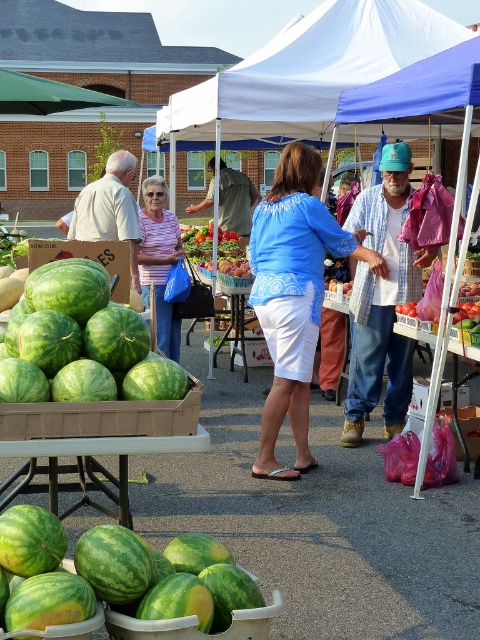
Does point (262, 465) come in front of point (360, 412)?

Yes, point (262, 465) is closer to viewer.

Is blue cotton blouse at center to the right of blue plaid shirt at center from the viewer's perspective?

No, blue cotton blouse at center is not to the right of blue plaid shirt at center.

Is point (285, 369) positioned before point (407, 362)?

Yes, it is.

Find the location of a particular element. The width and height of the screenshot is (480, 640). blue cotton blouse at center is located at coordinates (291, 296).

Is wooden crate at lower left above green textured shirt at center?

Actually, wooden crate at lower left is below green textured shirt at center.

Is point (126, 461) more distant than point (197, 208)?

No, (126, 461) is closer to viewer.

I want to click on wooden crate at lower left, so click(88, 467).

Is point (249, 259) behind point (120, 308)?

Yes, it is.

Looking at this image, does blue cotton blouse at center have a greater height compared to green matte watermelon at left?

Yes.

Between point (296, 461) and point (149, 353), which one is positioned behind?

The point (296, 461) is more distant.

Where is `blue cotton blouse at center`? blue cotton blouse at center is located at coordinates (291, 296).